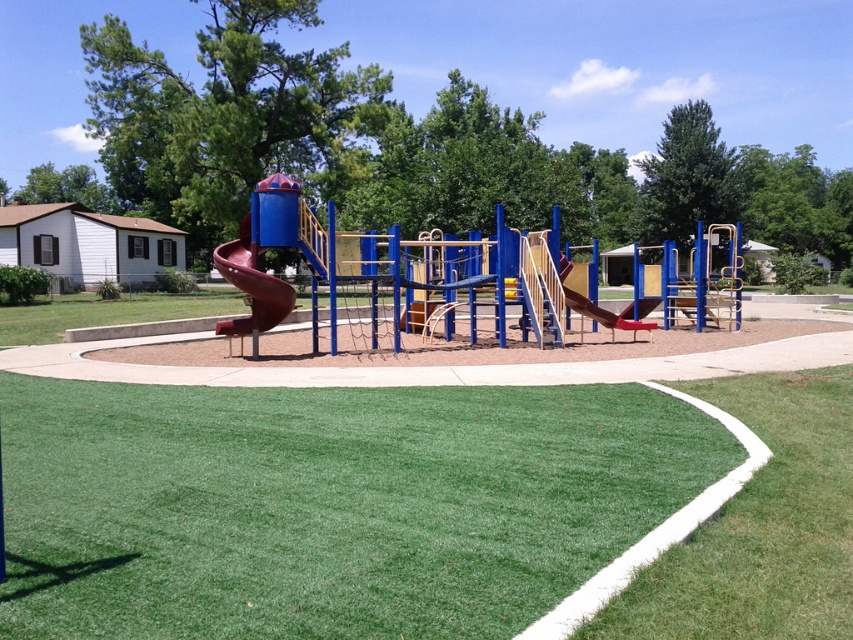
You are a parent trying to decide where to place a small toy box. The toy box is 30 cm wide. You have two options for placement near the playground equipment. One spot is on the green turf at lower right, and the other is next to the brown matte slide at center. Based on the available space, which location would allow the toy box to fit better?

The green turf at lower right is thinner than the brown matte slide at center, so the brown matte slide at center has more space and can accommodate the 30 cm wide toy box better.